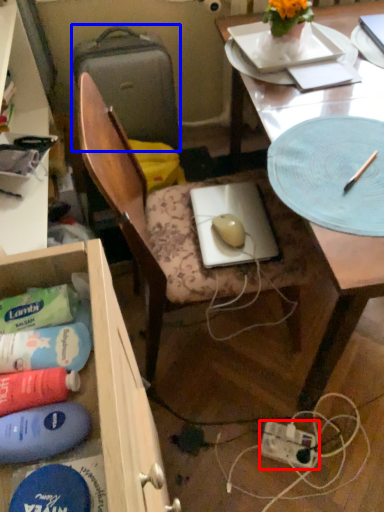
Question: Which object appears closest to the camera in this image, power plugs and sockets (highlighted by a red box) or suitcase (highlighted by a blue box)?

Choices:
 (A) power plugs and sockets
 (B) suitcase

Answer: (A)